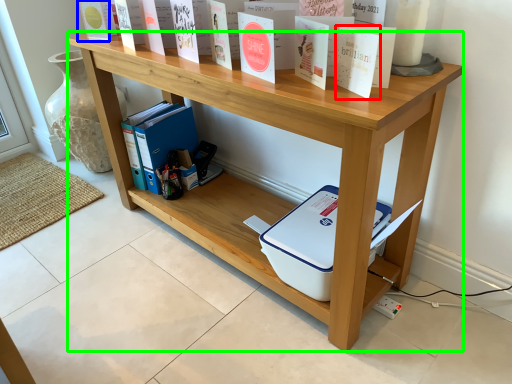
Question: Which is nearer to the paperback book (highlighted by a red box)? paperback book (highlighted by a blue box) or shelf (highlighted by a green box).

Choices:
 (A) paperback book
 (B) shelf

Answer: (B)